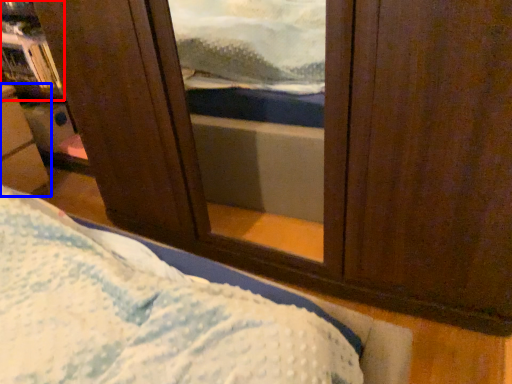
Question: Which point is further to the camera, bookshelf (highlighted by a red box) or furniture (highlighted by a blue box)?

Choices:
 (A) bookshelf
 (B) furniture

Answer: (A)